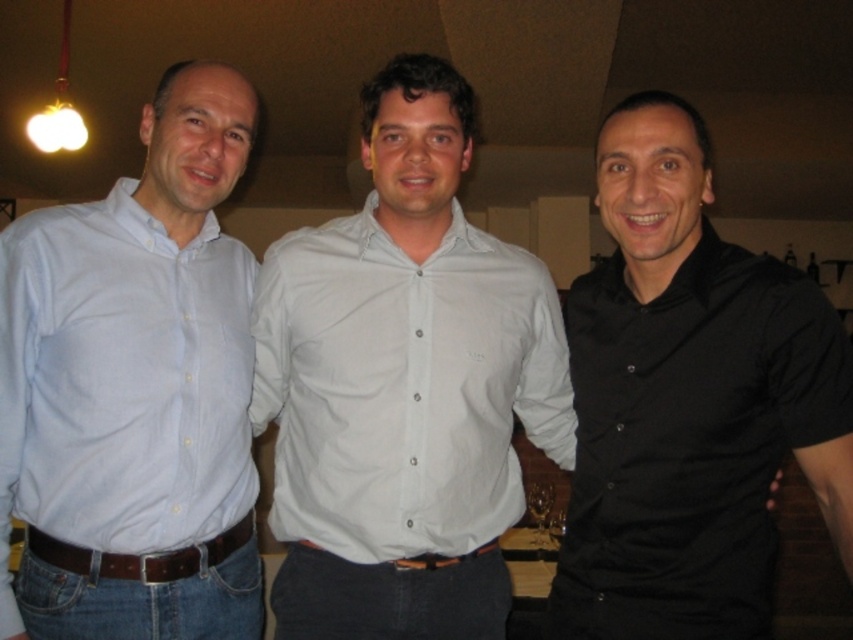
Is black matte shirt at right shorter than white cotton shirt at center?

In fact, black matte shirt at right may be taller than white cotton shirt at center.

Does black matte shirt at right have a larger size compared to white cotton shirt at center?

Correct, black matte shirt at right is larger in size than white cotton shirt at center.

Who is more forward, (640, 637) or (343, 280)?

Point (640, 637) is more forward.

This screenshot has height=640, width=853. Identify the location of black matte shirt at right. (688, 401).

Is white cotton shirt at center above brown leather belt at lower center?

Correct, white cotton shirt at center is located above brown leather belt at lower center.

Who is positioned more to the left, white cotton shirt at center or brown leather belt at lower center?

brown leather belt at lower center is more to the left.

Who is more distant from viewer, (439, 422) or (85, 548)?

The point (439, 422) is behind.

At what (x,y) coordinates should I click in order to perform the action: click on white cotton shirt at center. Please return your answer as a coordinate pair (x, y). Looking at the image, I should click on (404, 387).

Is light blue shirt at left closer to camera compared to brown leather belt at lower center?

Yes, it is in front of brown leather belt at lower center.

Is light blue shirt at left shorter than brown leather belt at lower center?

No, light blue shirt at left is not shorter than brown leather belt at lower center.

What do you see at coordinates (135, 390) in the screenshot? The image size is (853, 640). I see `light blue shirt at left` at bounding box center [135, 390].

Where is `light blue shirt at left`? Image resolution: width=853 pixels, height=640 pixels. light blue shirt at left is located at coordinates (135, 390).